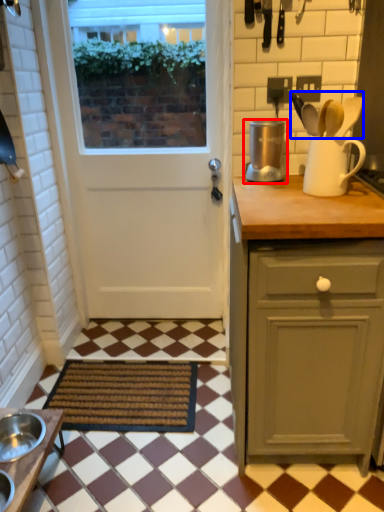
Question: Which point is further to the camera, kitchen appliance (highlighted by a red box) or silverware (highlighted by a blue box)?

Choices:
 (A) kitchen appliance
 (B) silverware

Answer: (A)